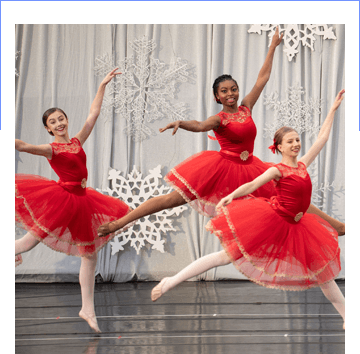
The height and width of the screenshot is (354, 360). Find the location of `stage`. stage is located at coordinates (182, 340).